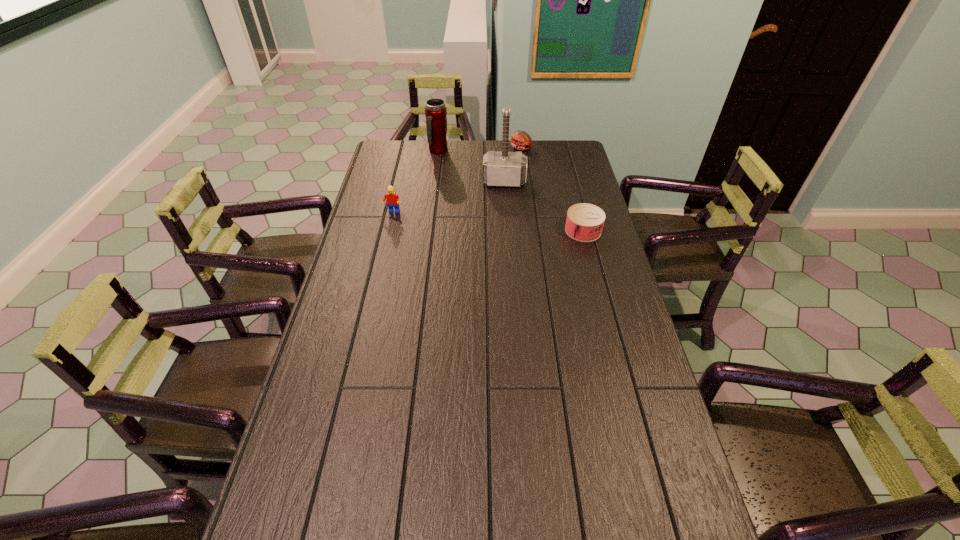
This screenshot has height=540, width=960. What are the coordinates of `the leftmost object` in the screenshot? It's located at (393, 200).

The image size is (960, 540). Identify the location of the second nearest object. (393, 200).

This screenshot has width=960, height=540. What are the coordinates of `the nearest object` in the screenshot? It's located at (584, 223).

Find the location of a particular element. The image size is (960, 540). can is located at coordinates (584, 223).

Where is `tomato`? Image resolution: width=960 pixels, height=540 pixels. tomato is located at coordinates (521, 141).

The width and height of the screenshot is (960, 540). Find the location of `the tallest object`. the tallest object is located at coordinates (502, 169).

At what (x,y) coordinates should I click in order to perform the action: click on the third nearest object. Please return your answer as a coordinate pair (x, y). The image size is (960, 540). Looking at the image, I should click on (502, 169).

Locate an element on the screen. This screenshot has height=540, width=960. the fourth object from right to left is located at coordinates (435, 110).

This screenshot has width=960, height=540. In order to click on the fourth shortest object in this screenshot , I will do `click(435, 110)`.

This screenshot has width=960, height=540. I want to click on vacant space located on the front-facing side of the leftmost object, so click(x=379, y=272).